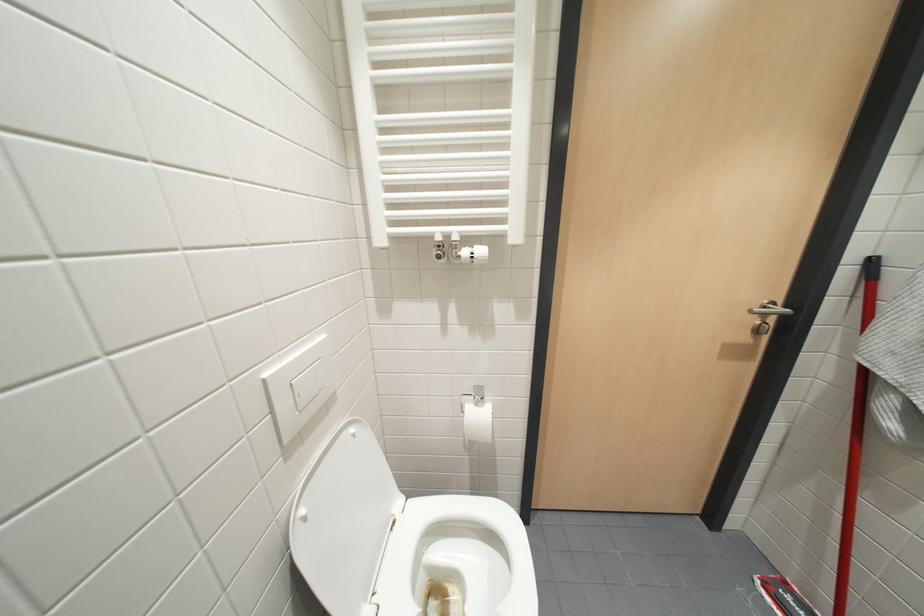
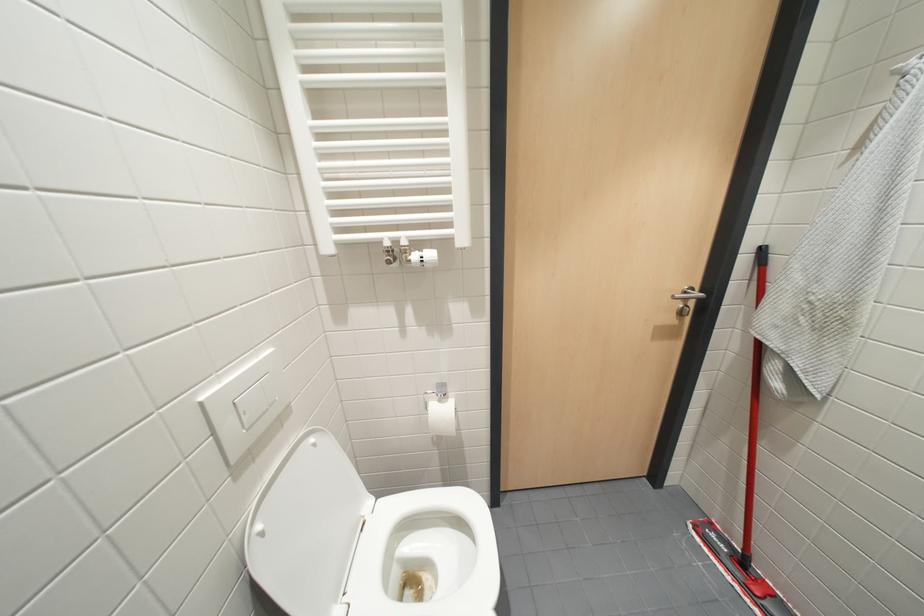
Question: The camera is either moving clockwise (left) or counter-clockwise (right) around the object. The first image is from the beginning of the video and the second image is from the end. Is the camera moving left or right when shooting the video?

Choices:
 (A) Left
 (B) Right

Answer: (A)